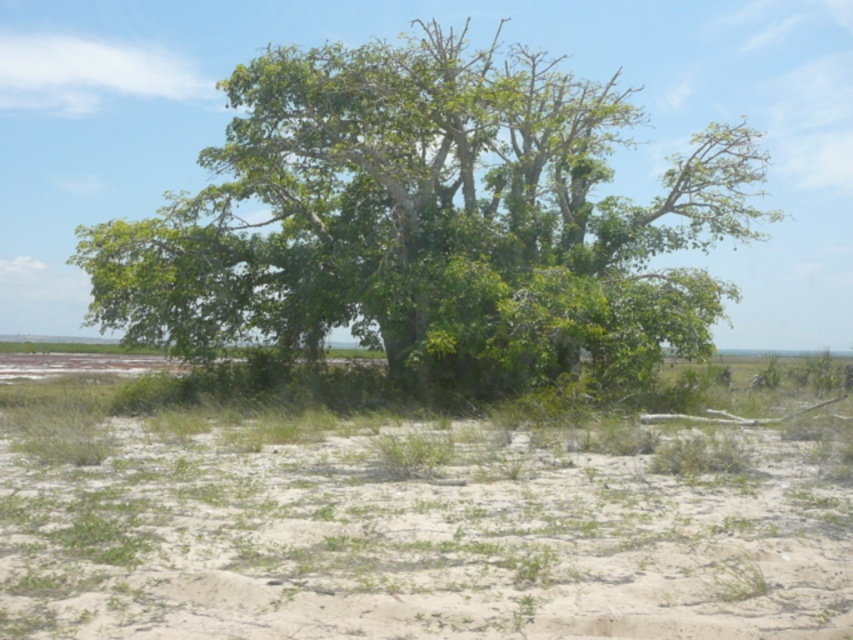
You are standing at the edge of a forest and see the green leafy tree at center and the white sandy soil at lower center. Which object is located to the right of the other?

The white sandy soil at lower center is located to the right of the green leafy tree at center because the green leafy tree at center is positioned on the left side of white sandy soil at lower center.

Looking at this image, you are planning to plant a new tree in your backyard and want to ensure there is enough space. You see the green leafy tree at center and the white sandy soil at lower center in the image. Which object takes up more horizontal space?

The green leafy tree at center takes up more horizontal space than the white sandy soil at lower center because its width surpasses the soil.